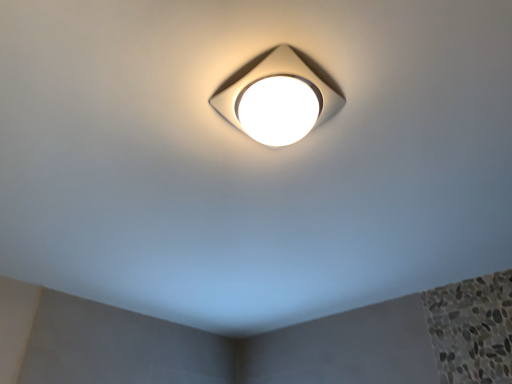
Image resolution: width=512 pixels, height=384 pixels. What do you see at coordinates (278, 100) in the screenshot? I see `white glossy lampshade at center` at bounding box center [278, 100].

You are a GUI agent. You are given a task and a screenshot of the screen. Output one action in this format:
    pyautogui.click(x=<x>, y=<y>)
    Task: Click on the white glossy lampshade at center
    This screenshot has width=512, height=384.
    Given the screenshot: What is the action you would take?
    pyautogui.click(x=278, y=100)

Locate an element on the screen. The height and width of the screenshot is (384, 512). white glossy lampshade at center is located at coordinates (278, 100).